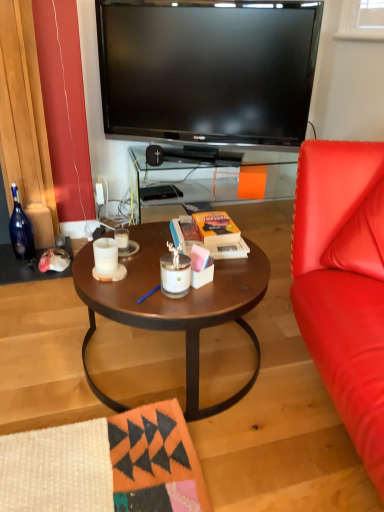
Question: Does point (150, 162) appear closer or farther from the camera than point (195, 239)?

Choices:
 (A) farther
 (B) closer

Answer: (A)

Question: Relative to orange matte book at center, is black plastic speaker at center in front or behind?

Choices:
 (A) front
 (B) behind

Answer: (B)

Question: Which of these objects is positioned closest to the black plastic speaker at center?

Choices:
 (A) blue glass bottle at left
 (B) wooden table at center
 (C) white matte candle at center, which is counted as the 1th coffee cup, starting from the back
 (D) matte brown coffee table at center
 (E) white matte candle at center, which appears as the first coffee cup when viewed from the front

Answer: (B)

Question: Which object is positioned farthest from the wooden table at center?

Choices:
 (A) black plastic speaker at center
 (B) white matte candle at center, the second coffee cup when ordered from front to back
 (C) matte brown coffee table at center
 (D) white matte candle at center, placed as the second coffee cup when sorted from back to front
 (E) blue glass bottle at left

Answer: (D)